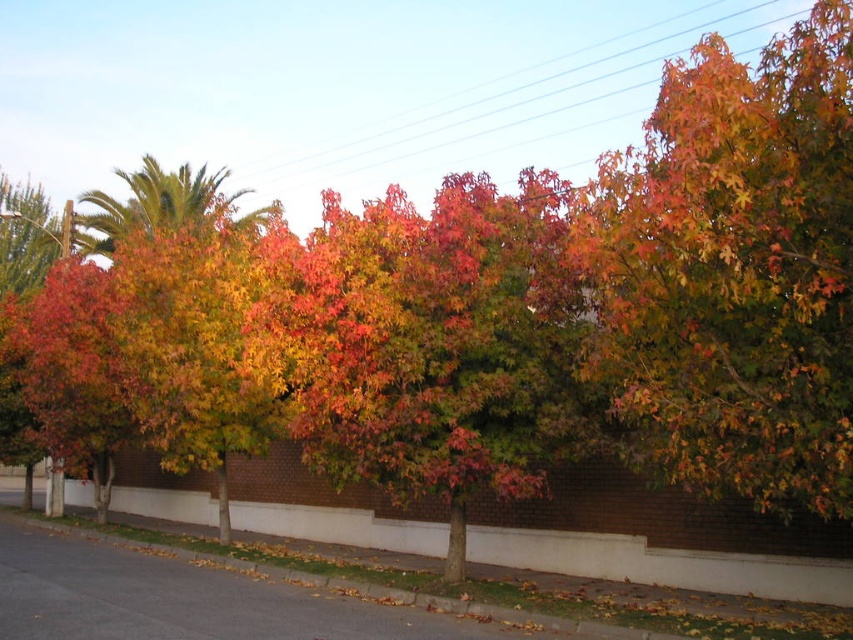
Question: Which is farther from the white concrete curb at lower center?

Choices:
 (A) shiny red leaves at center
 (B) multicolored foliage at upper right

Answer: (B)

Question: Which object appears closest to the camera in this image?

Choices:
 (A) shiny red leaves at center
 (B) white concrete curb at lower center

Answer: (A)

Question: Does shiny red leaves at center have a smaller size compared to white concrete curb at lower center?

Choices:
 (A) yes
 (B) no

Answer: (B)

Question: Can you confirm if multicolored foliage at upper right is bigger than white concrete curb at lower center?

Choices:
 (A) no
 (B) yes

Answer: (B)

Question: Which point is farther from the camera taking this photo?

Choices:
 (A) (759, 304)
 (B) (332, 477)
 (C) (389, 536)

Answer: (C)

Question: In this image, where is multicolored foliage at upper right located relative to white concrete curb at lower center?

Choices:
 (A) right
 (B) left

Answer: (A)